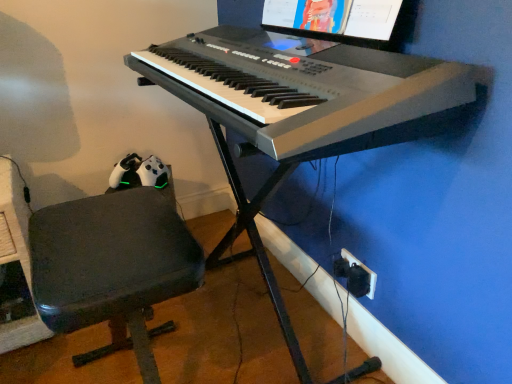
What do you see at coordinates (308, 90) in the screenshot?
I see `white plastic keyboard at center` at bounding box center [308, 90].

Measure the distance between white plastic keyboard at center and camera.

white plastic keyboard at center is 23.40 inches away from camera.

What do you see at coordinates (113, 263) in the screenshot? This screenshot has width=512, height=384. I see `dark gray fabric chair at lower left` at bounding box center [113, 263].

What is the approximate height of black plastic plug at lower right?

black plastic plug at lower right is 4.18 inches in height.

Describe the element at coordinates (355, 275) in the screenshot. I see `black plastic plug at lower right` at that location.

This screenshot has width=512, height=384. What do you see at coordinates (344, 20) in the screenshot?
I see `matte black monitor at upper center` at bounding box center [344, 20].

Identify the location of white plastic keyboard at center. (308, 90).

From a real-world perspective, is white plastic keyboard at center physically located above or below matte black monitor at upper center?

Clearly, from a real-world perspective, white plastic keyboard at center is below matte black monitor at upper center.

Based on the photo, is white plastic keyboard at center surrounding matte black monitor at upper center?

No, matte black monitor at upper center is located outside of white plastic keyboard at center.

Based on the photo, how far apart are white plastic keyboard at center and matte black monitor at upper center?

They are 7.78 inches apart.

Which of these two, white plastic keyboard at center or matte black monitor at upper center, stands shorter?

matte black monitor at upper center.

Which is more distant, (370, 281) or (254, 32)?

The point (254, 32) is farther.

Where is `musical keyboard in front of the black plastic plug at lower right`? The height and width of the screenshot is (384, 512). musical keyboard in front of the black plastic plug at lower right is located at coordinates (308, 90).

In the scene shown: In the image, is black plastic plug at lower right positioned in front of or behind white plastic keyboard at center?

Visually, black plastic plug at lower right is located behind white plastic keyboard at center.

Is black plastic plug at lower right wider than white plastic keyboard at center?

No.

In terms of size, does black plastic plug at lower right appear bigger or smaller than dark gray fabric chair at lower left?

Clearly, black plastic plug at lower right is smaller in size than dark gray fabric chair at lower left.

Considering the relative sizes of black plastic plug at lower right and dark gray fabric chair at lower left in the image provided, is black plastic plug at lower right thinner than dark gray fabric chair at lower left?

Indeed, black plastic plug at lower right has a lesser width compared to dark gray fabric chair at lower left.

From a real-world perspective, relative to dark gray fabric chair at lower left, is black plastic plug at lower right vertically above or below?

From a real-world perspective, black plastic plug at lower right is physically below dark gray fabric chair at lower left.

How different are the orientations of black plastic plug at lower right and dark gray fabric chair at lower left in degrees?

1.46 degrees.

Considering the positions of objects white plastic keyboard at center and black plastic plug at lower right in the image provided, who is more to the left, white plastic keyboard at center or black plastic plug at lower right?

From the viewer's perspective, white plastic keyboard at center appears more on the left side.

From the image's perspective, is white plastic keyboard at center above black plastic plug at lower right?

Indeed, from the image's perspective, white plastic keyboard at center is shown above black plastic plug at lower right.

From a real-world perspective, who is located higher, white plastic keyboard at center or black plastic plug at lower right?

white plastic keyboard at center is physically above.

Does white plastic keyboard at center have a lesser height compared to black plastic plug at lower right?

Correct, white plastic keyboard at center is not as tall as black plastic plug at lower right.

Is dark gray fabric chair at lower left in contact with matte black monitor at upper center?

No, dark gray fabric chair at lower left is not with matte black monitor at upper center.

Considering the sizes of dark gray fabric chair at lower left and matte black monitor at upper center in the image, is dark gray fabric chair at lower left bigger or smaller than matte black monitor at upper center?

Considering their sizes, dark gray fabric chair at lower left takes up more space than matte black monitor at upper center.

Choose the correct answer: Is dark gray fabric chair at lower left inside matte black monitor at upper center or outside it?

dark gray fabric chair at lower left is not enclosed by matte black monitor at upper center.

From the picture: From a real-world perspective, is dark gray fabric chair at lower left below matte black monitor at upper center?

Correct, in the physical world, dark gray fabric chair at lower left is lower than matte black monitor at upper center.

Can you tell me how much dark gray fabric chair at lower left and black plastic plug at lower right differ in facing direction?

1.46 degrees separate the facing orientations of dark gray fabric chair at lower left and black plastic plug at lower right.

Does dark gray fabric chair at lower left touch black plastic plug at lower right?

dark gray fabric chair at lower left and black plastic plug at lower right are not in contact.

Is dark gray fabric chair at lower left located outside black plastic plug at lower right?

Yes, dark gray fabric chair at lower left is not within black plastic plug at lower right.

At what (x,y) coordinates should I click in order to perform the action: click on plug above the dark gray fabric chair at lower left (from the image's perspective). Please return your answer as a coordinate pair (x, y). The image size is (512, 384). Looking at the image, I should click on (355, 275).

Considering the points (322, 1) and (165, 218), which point is behind, point (322, 1) or point (165, 218)?

The point (165, 218) is more distant.

Can you tell me how much matte black monitor at upper center and dark gray fabric chair at lower left differ in facing direction?

There is a 4.16-degree angle between the facing directions of matte black monitor at upper center and dark gray fabric chair at lower left.

From a real-world perspective, who is located higher, matte black monitor at upper center or dark gray fabric chair at lower left?

matte black monitor at upper center is physically above.

Considering the sizes of objects matte black monitor at upper center and dark gray fabric chair at lower left in the image provided, who is bigger, matte black monitor at upper center or dark gray fabric chair at lower left?

With larger size is dark gray fabric chair at lower left.

Image resolution: width=512 pixels, height=384 pixels. In order to click on musical keyboard that appears below the matte black monitor at upper center (from a real-world perspective) in this screenshot , I will do `click(308, 90)`.

Image resolution: width=512 pixels, height=384 pixels. What are the coordinates of `plug behind the white plastic keyboard at center` in the screenshot? It's located at (355, 275).

Based on their spatial positions, is white plastic keyboard at center or dark gray fabric chair at lower left closer to white plastic keyboard at center?

white plastic keyboard at center is positioned closer to the anchor white plastic keyboard at center.

From the picture: Based on their spatial positions, is white plastic keyboard at center or matte black monitor at upper center closer to white plastic keyboard at center?

white plastic keyboard at center is closer to white plastic keyboard at center.

From the image, which object appears to be nearer to black plastic plug at lower right, white plastic keyboard at center or dark gray fabric chair at lower left?

white plastic keyboard at center lies closer to black plastic plug at lower right than the other object.

Estimate the real-world distances between objects in this image. Which object is closer to dark gray fabric chair at lower left, matte black monitor at upper center or black plastic plug at lower right?

Among the two, black plastic plug at lower right is located nearer to dark gray fabric chair at lower left.

Considering their positions, is white plastic keyboard at center positioned further to matte black monitor at upper center than white plastic keyboard at center?

Among the two, white plastic keyboard at center is located further to matte black monitor at upper center.

From the image, which object appears to be farther from white plastic keyboard at center, white plastic keyboard at center or dark gray fabric chair at lower left?

Based on the image, dark gray fabric chair at lower left appears to be further to white plastic keyboard at center.

Considering their positions, is black plastic plug at lower right positioned further to dark gray fabric chair at lower left than white plastic keyboard at center?

black plastic plug at lower right is further to dark gray fabric chair at lower left.

Looking at the image, which one is located further to white plastic keyboard at center, matte black monitor at upper center or black plastic plug at lower right?

black plastic plug at lower right is further to white plastic keyboard at center.

This screenshot has width=512, height=384. What are the coordinates of `plug between white plastic keyboard at center and dark gray fabric chair at lower left vertically` in the screenshot? It's located at (355, 275).

Where is `musical keyboard between matte black monitor at upper center and white plastic keyboard at center in the up-down direction`? musical keyboard between matte black monitor at upper center and white plastic keyboard at center in the up-down direction is located at coordinates (308, 90).

The height and width of the screenshot is (384, 512). I want to click on piano between matte black monitor at upper center and black plastic plug at lower right in the up-down direction, so click(300, 111).

Where is `piano between white plastic keyboard at center and dark gray fabric chair at lower left in the up-down direction`? piano between white plastic keyboard at center and dark gray fabric chair at lower left in the up-down direction is located at coordinates (300, 111).